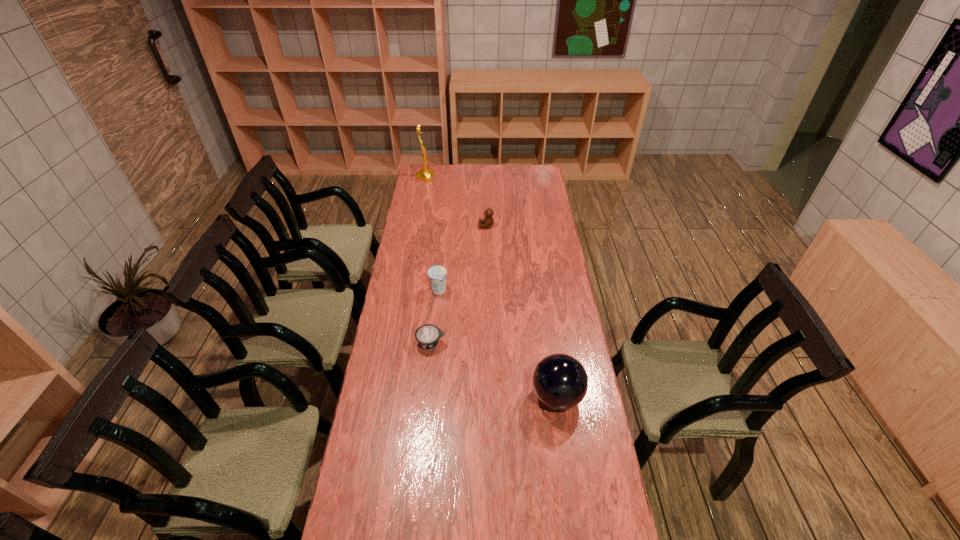
The width and height of the screenshot is (960, 540). I want to click on award present at the left edge, so click(426, 174).

This screenshot has width=960, height=540. Identify the location of yogurt that is at the left edge. (428, 335).

The width and height of the screenshot is (960, 540). I want to click on object that is at the right edge, so click(560, 381).

At what (x,y) coordinates should I click in order to perform the action: click on object at the far left corner. Please return your answer as a coordinate pair (x, y). The height and width of the screenshot is (540, 960). Looking at the image, I should click on (426, 174).

Identify the location of free region at the far edge. This screenshot has width=960, height=540. (462, 181).

The width and height of the screenshot is (960, 540). In order to click on blank area at the left edge in this screenshot , I will do `click(397, 373)`.

This screenshot has width=960, height=540. I want to click on vacant space at the right edge of the desktop, so click(x=536, y=272).

This screenshot has width=960, height=540. In the image, there is a desktop. Identify the location of vacant space at the far right corner. (534, 181).

Image resolution: width=960 pixels, height=540 pixels. In order to click on free space between the taller yogurt and the rightmost object in this screenshot , I will do `click(498, 343)`.

You are a GUI agent. You are given a task and a screenshot of the screen. Output one action in this format:
    pyautogui.click(x=<x>, y=<y>)
    Task: Click on the free area in between the fourth nearest object and the shortest object
    The height and width of the screenshot is (540, 960).
    Given the screenshot: What is the action you would take?
    pyautogui.click(x=459, y=285)